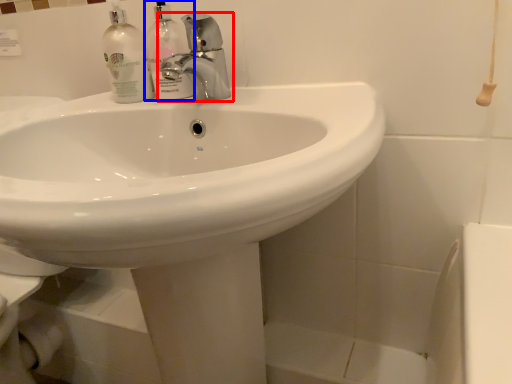
Question: Which of the following is the farthest to the observer, tap (highlighted by a red box) or cleaning product (highlighted by a blue box)?

Choices:
 (A) tap
 (B) cleaning product

Answer: (B)